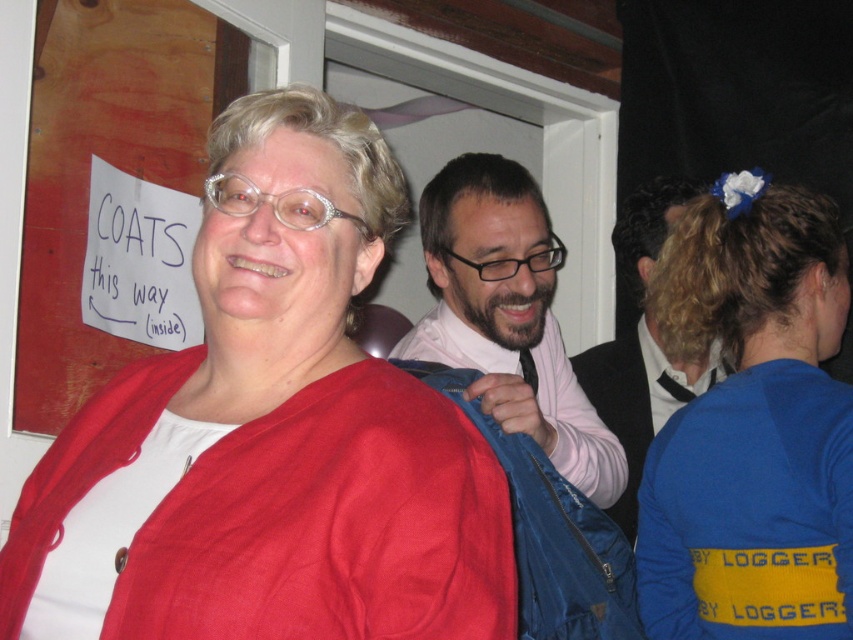
Where is the matte red sweater at center located in the image?

The matte red sweater at center is located at point 0.667 on the x axis and 0.334 on the y axis.

Based on the photo, you are standing in the room and want to take a photo of both the woman in the red jacket and the man adjusting his blue jacket. Which of the two points, point 1 at coordinates (590, 452) or point 2 at (635, 292), should you focus on first to ensure both subjects are in clear focus?

Point 1 at coordinates (590, 452) is closer to the camera than point 2 at (635, 292). To ensure both subjects are in clear focus, you should focus on the closer point first, which is point 1 at coordinates (590, 452).

In the scene shown: You are a guest at the party and want to know which clothing item is closer to you. The options are the matte red sweater at center and the blue jersey at upper right. Based on their positions, which one is nearer?

The matte red sweater at center is nearer because it is positioned over the blue jersey at upper right, indicating it is closer to the viewer.